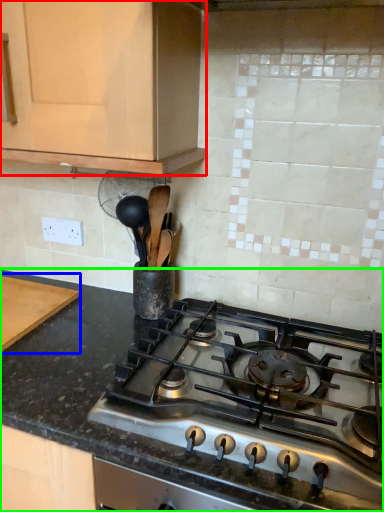
Question: Which object is the closest to the cabinetry (highlighted by a red box)? Choose among these: cutting board (highlighted by a blue box) or countertop (highlighted by a green box).

Choices:
 (A) cutting board
 (B) countertop

Answer: (B)